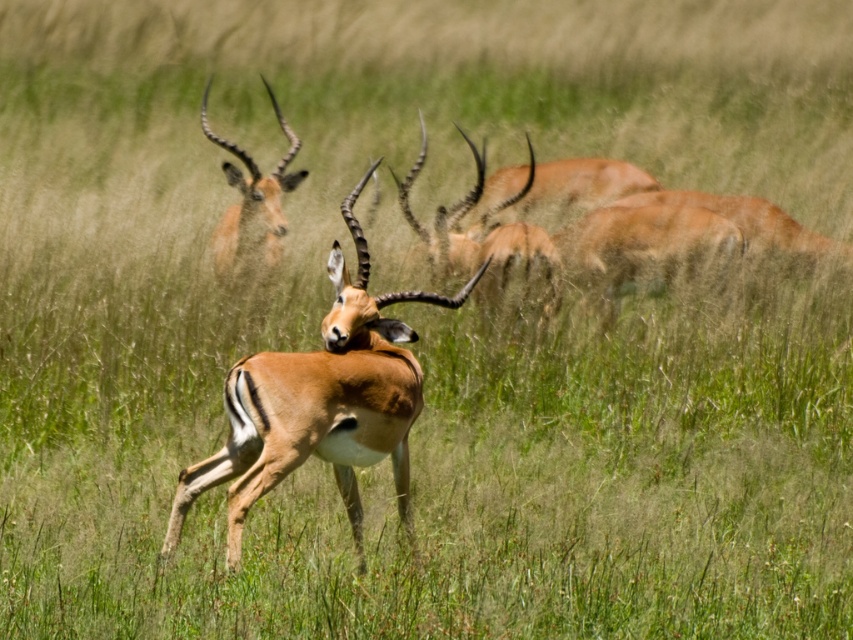
You are a wildlife photographer aiming to capture a photo of the brown glossy antelope at center and the brown velvet antelope at center. Which antelope should you focus on if you want to highlight the taller one in your shot?

The brown glossy antelope at center is taller than the brown velvet antelope at center, so you should focus on the brown glossy antelope at center to highlight the taller one.

You are a wildlife photographer aiming to capture the brown glossy antelope at center. You notice a point at coordinates (320,403) in the image. Is this point likely located on the brown glossy antelope at center?

Yes, the point at coordinates (320,403) corresponds to the brown glossy antelope at center according to the description.